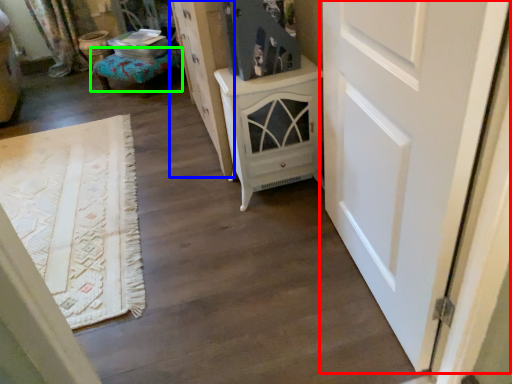
Question: Considering the real-world distances, which object is farthest from door (highlighted by a red box)? cabinetry (highlighted by a blue box) or furniture (highlighted by a green box)?

Choices:
 (A) cabinetry
 (B) furniture

Answer: (B)